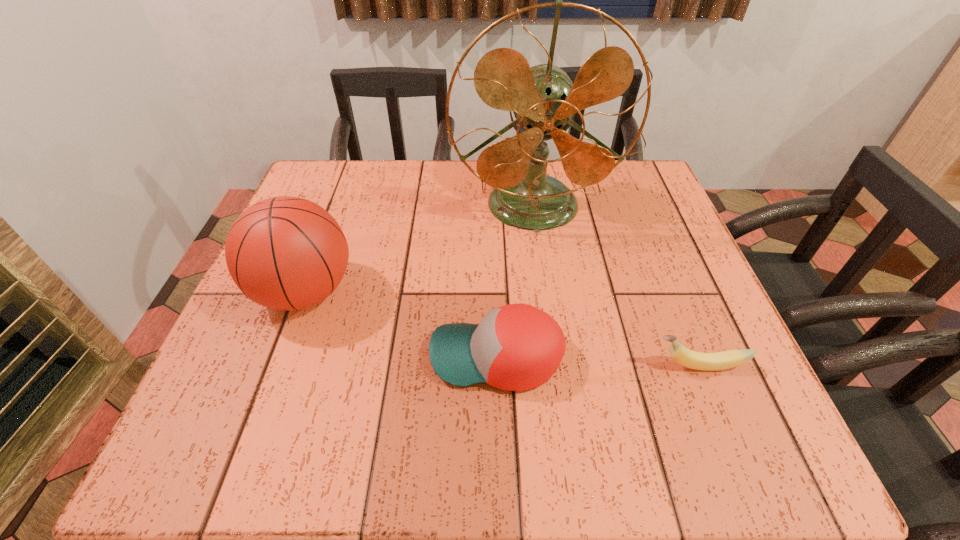
The width and height of the screenshot is (960, 540). Identify the location of empty location between the banana and the baseball cap. (597, 361).

I want to click on vacant space in between the baseball cap and the basketball, so click(400, 325).

Where is `vacant region between the tallest object and the baseball cap`? The image size is (960, 540). vacant region between the tallest object and the baseball cap is located at coordinates (515, 281).

Find the location of `empty space between the banana and the farthest object`. empty space between the banana and the farthest object is located at coordinates (615, 286).

The width and height of the screenshot is (960, 540). What are the coordinates of `vacant area that lies between the banana and the tallest object` in the screenshot? It's located at (615, 286).

You are a GUI agent. You are given a task and a screenshot of the screen. Output one action in this format:
    pyautogui.click(x=<x>, y=<y>)
    Task: Click on the unoccupied area between the third shortest object and the tallest object
    
    Given the screenshot: What is the action you would take?
    pyautogui.click(x=420, y=249)

You are a GUI agent. You are given a task and a screenshot of the screen. Output one action in this format:
    pyautogui.click(x=<x>, y=<y>)
    Task: Click on the object that is the second closest one to the third shortest object
    
    Given the screenshot: What is the action you would take?
    pyautogui.click(x=544, y=100)

Identify which object is located as the nearest to the baseball cap. Please provide its 2D coordinates. Your answer should be formatted as a tuple, i.e. [(x, y)], where the tuple contains the x and y coordinates of a point satisfying the conditions above.

[(723, 360)]